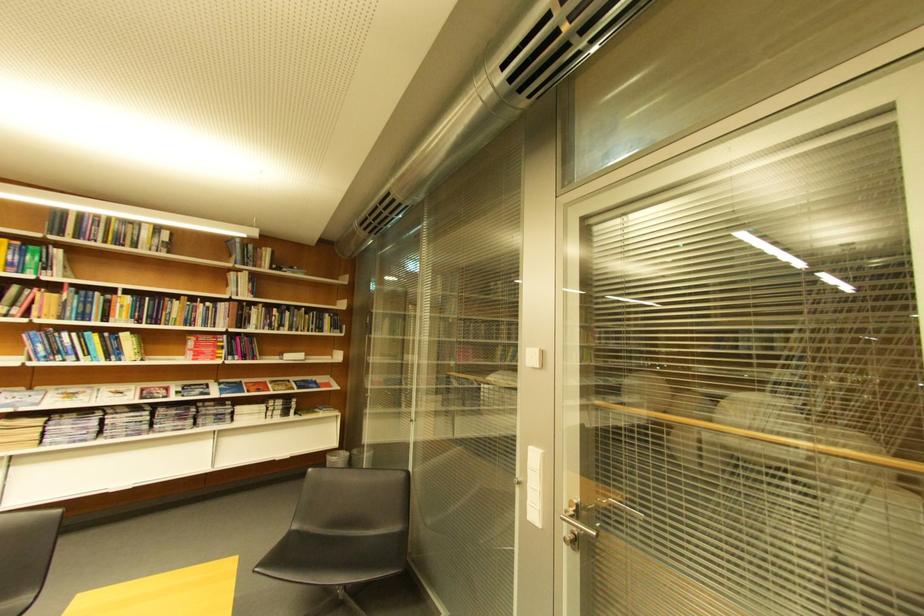
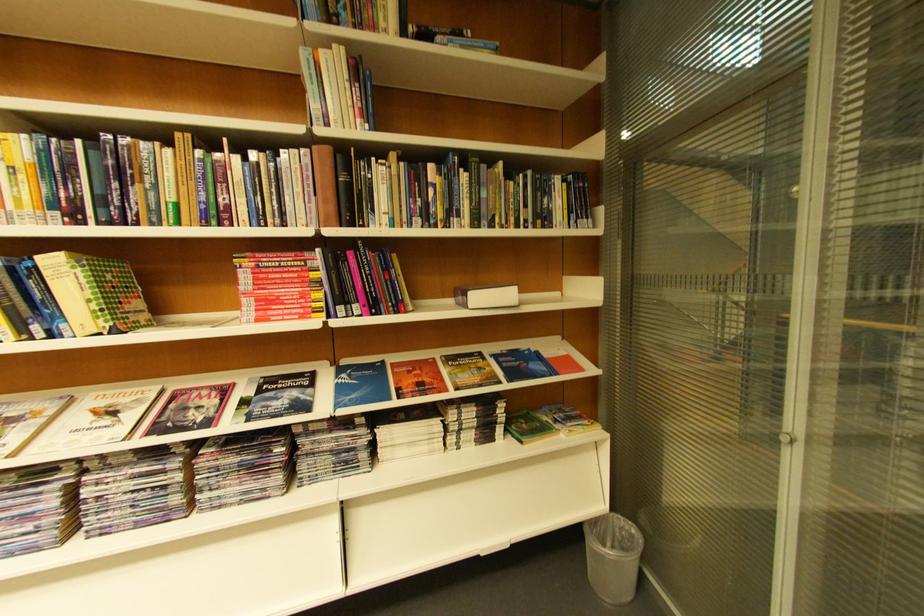
The point at (246, 320) is marked in the first image. Where is the corresponding point in the second image?

(342, 196)